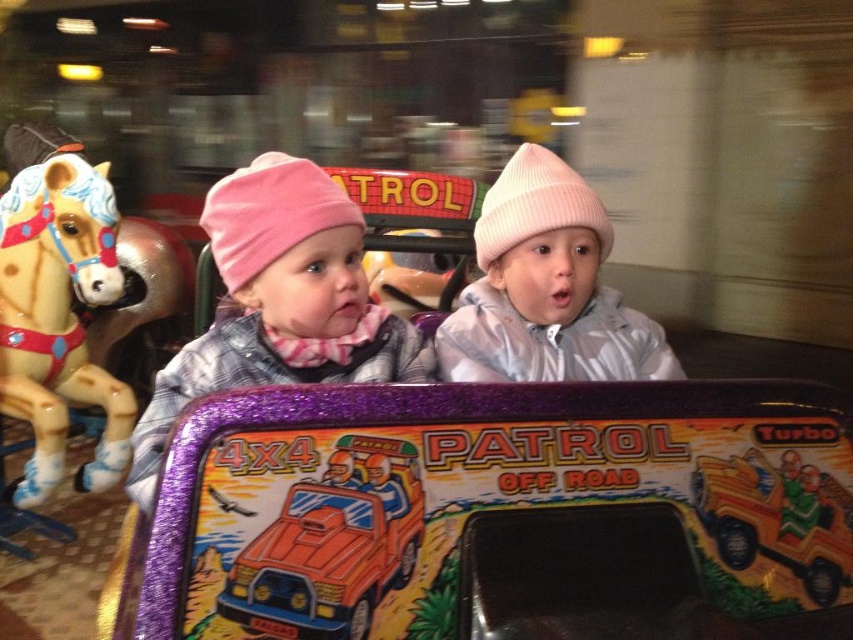
Does pink knit hat at center appear over painted wood horse at left?

Yes, pink knit hat at center is above painted wood horse at left.

Does pink knit hat at center come behind painted wood horse at left?

No.

Which is in front, point (494, 364) or point (44, 173)?

Point (494, 364) is more forward.

The height and width of the screenshot is (640, 853). I want to click on pink knit hat at center, so click(546, 289).

Locate an element on the screen. pink knit hat at upper left is located at coordinates (280, 301).

Is pink knit hat at center to the left of orange matte plastic toy car at center from the viewer's perspective?

Incorrect, pink knit hat at center is not on the left side of orange matte plastic toy car at center.

Is pink knit hat at center above orange matte plastic toy car at center?

Correct, pink knit hat at center is located above orange matte plastic toy car at center.

Which is in front, point (535, 172) or point (323, 538)?

Point (323, 538) is in front.

Where is `pink knit hat at center`? The image size is (853, 640). pink knit hat at center is located at coordinates (546, 289).